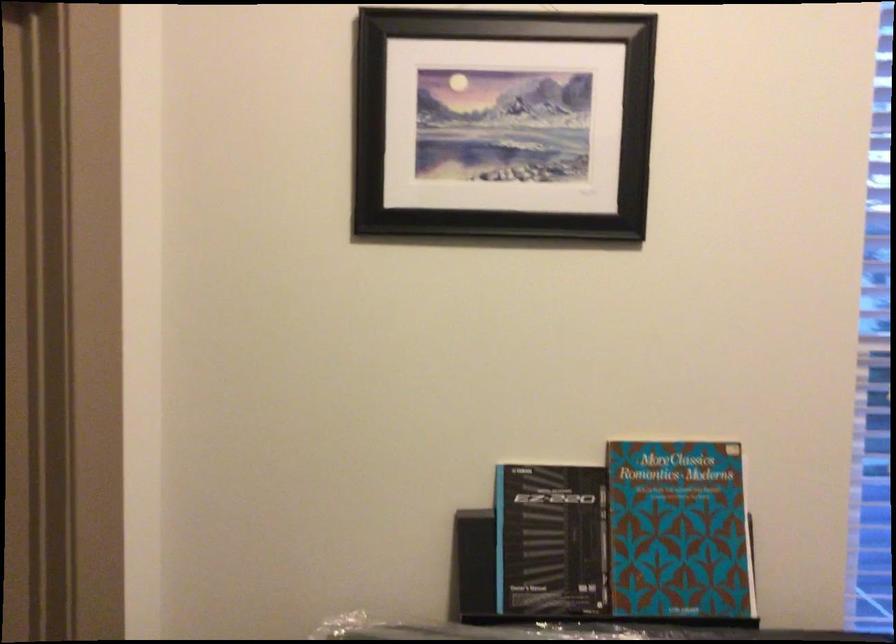
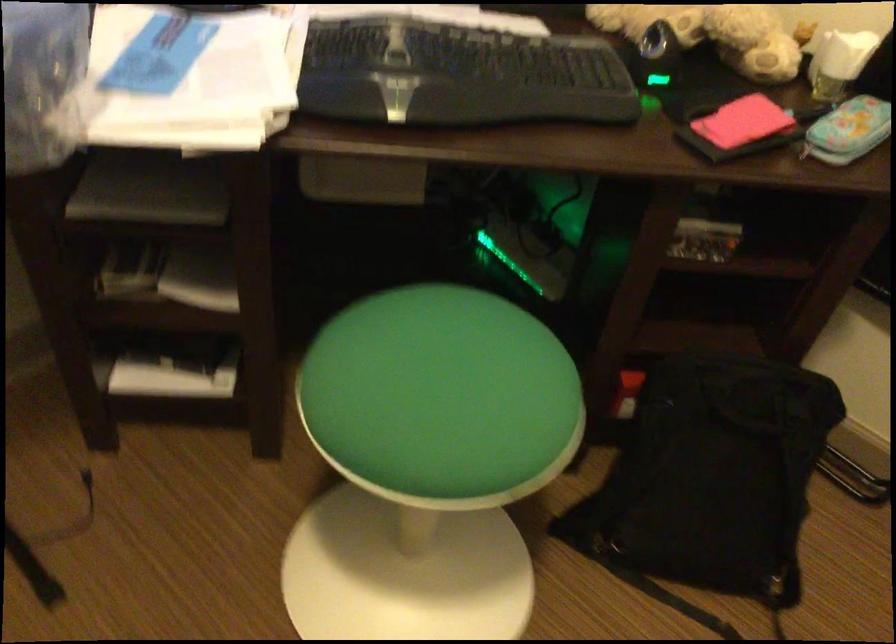
The images are taken continuously from a first-person perspective. In which direction is your viewpoint rotating?

The camera rotated toward right-down.